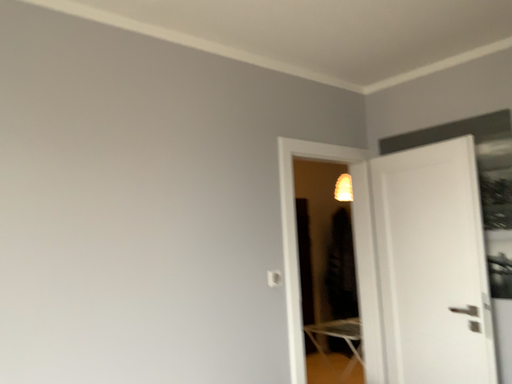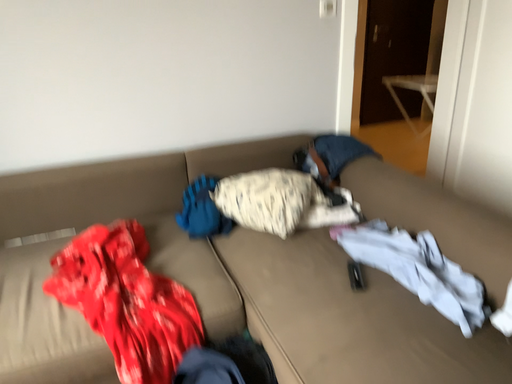
Question: How did the camera likely rotate when shooting the video?

Choices:
 (A) rotated right
 (B) rotated left

Answer: (B)